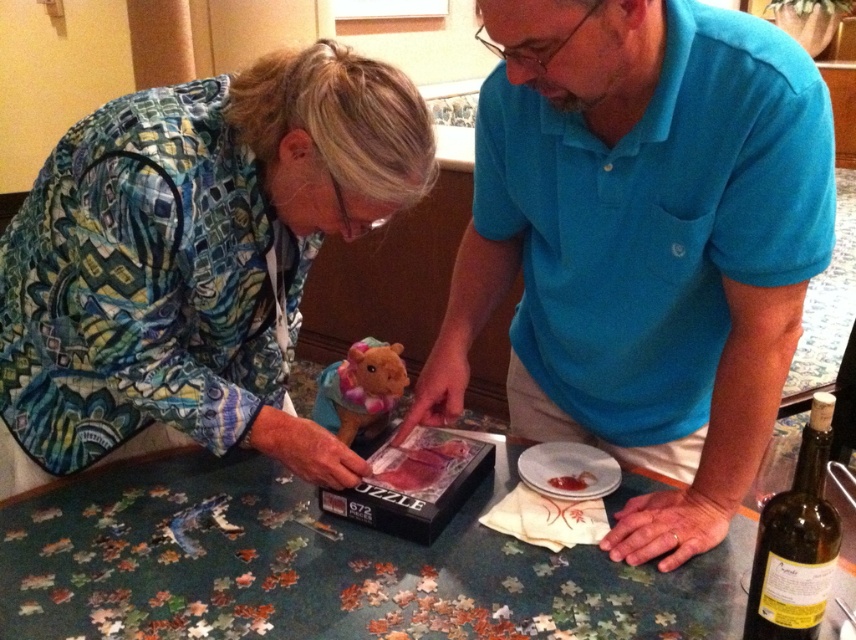
Who is more forward, (x=424, y=448) or (x=572, y=477)?

Positioned in front is point (x=572, y=477).

Who is shorter, translucent plastic puzzle box at center or smooth red sauce at lower center?

With less height is smooth red sauce at lower center.

Is point (447, 474) positioned behind point (580, 472)?

No, it is not.

Identify the location of translucent plastic puzzle box at center. Image resolution: width=856 pixels, height=640 pixels. (420, 461).

Between printed fabric shirt at lower left and smooth red sauce at lower center, which one has less height?

smooth red sauce at lower center

Is printed fabric shirt at lower left further to camera compared to smooth red sauce at lower center?

No.

The width and height of the screenshot is (856, 640). Describe the element at coordinates (194, 260) in the screenshot. I see `printed fabric shirt at lower left` at that location.

Image resolution: width=856 pixels, height=640 pixels. Identify the location of printed fabric shirt at lower left. 194,260.

Is point (598, 396) more distant than point (168, 456)?

No, it is in front of (168, 456).

Between blue cotton shirt at upper right and wooden puzzle pieces at center, which one appears on the left side from the viewer's perspective?

wooden puzzle pieces at center

Does point (587, 125) come behind point (6, 593)?

Yes.

What are the coordinates of `blue cotton shirt at upper right` in the screenshot? It's located at (642, 243).